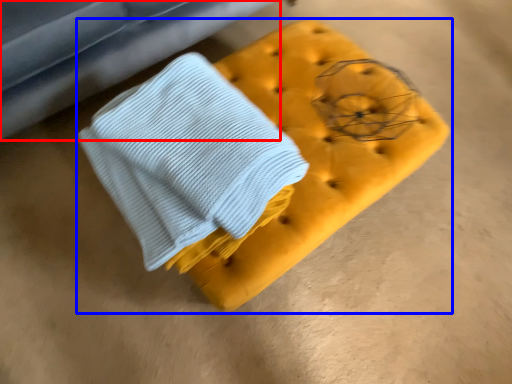
Question: Which object is further to the camera taking this photo, furniture (highlighted by a red box) or furniture (highlighted by a blue box)?

Choices:
 (A) furniture
 (B) furniture

Answer: (A)